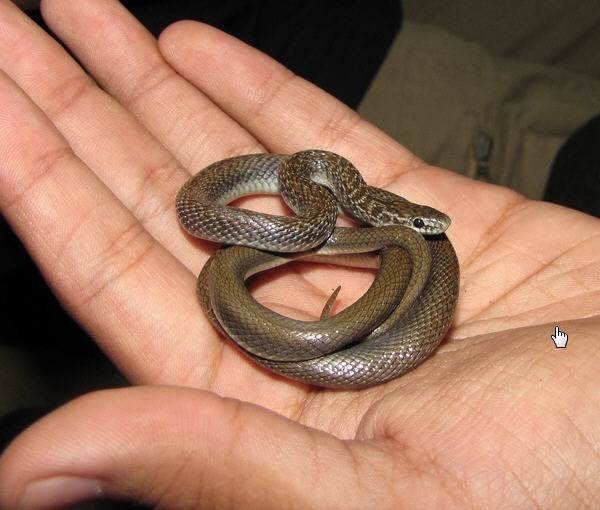
Find the location of a particular element. The width and height of the screenshot is (600, 510). mouse is located at coordinates (561, 341).